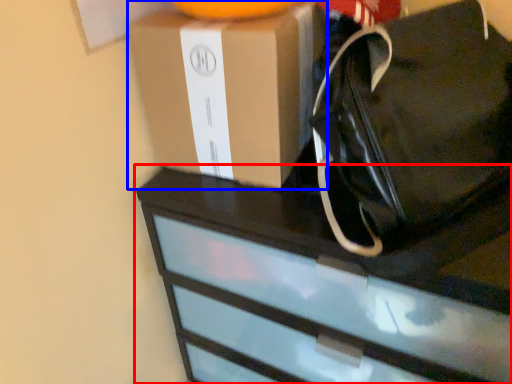
Question: Which object is further to the camera taking this photo, chest of drawers (highlighted by a red box) or box (highlighted by a blue box)?

Choices:
 (A) chest of drawers
 (B) box

Answer: (B)